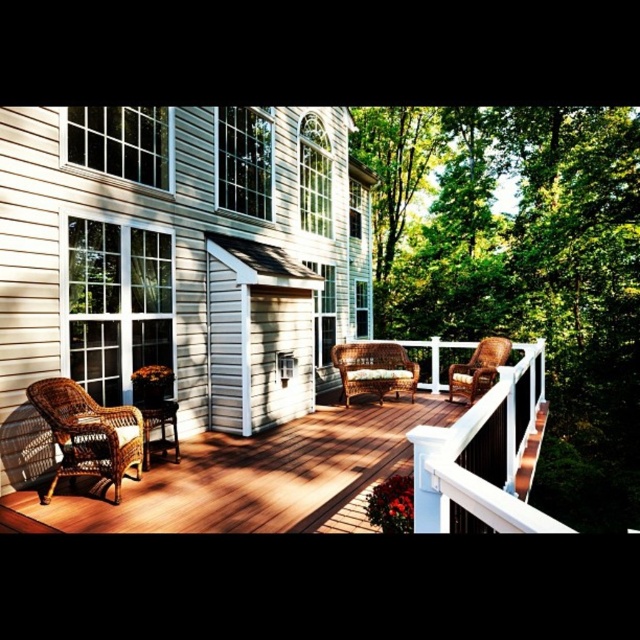
Who is lower down, beige siding at left or woven wicker chairs at lower left?

woven wicker chairs at lower left

Who is more forward, (8, 477) or (156, 470)?

Point (8, 477)

Who is more forward, (326,292) or (140,490)?

Point (140,490) is in front.

The height and width of the screenshot is (640, 640). Find the location of `beige siding at left`. beige siding at left is located at coordinates (177, 260).

Between woven wicker chairs at lower left and woven rattan chair at center, which one is positioned higher?

woven rattan chair at center is above.

Does point (518, 449) come closer to viewer compared to point (461, 385)?

Yes, it is.

Does point (12, 509) come in front of point (467, 380)?

Yes, it is.

Where is `woven wicker chairs at lower left`? The height and width of the screenshot is (640, 640). woven wicker chairs at lower left is located at coordinates (336, 470).

Can you confirm if brown wicker chair at left is wider than woven rattan chair at center?

Incorrect, brown wicker chair at left's width does not surpass woven rattan chair at center's.

Is brown wicker chair at left in front of woven rattan chair at center?

Yes, it is.

Identify the location of brown wicker chair at left. This screenshot has width=640, height=640. (88, 433).

Identify the location of brown wicker chair at left. The height and width of the screenshot is (640, 640). (88, 433).